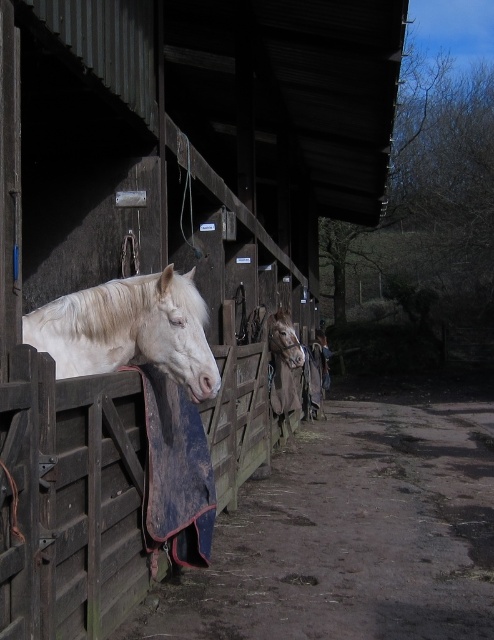
Question: Among these points, which one is farthest from the camera?

Choices:
 (A) (42, 472)
 (B) (182, 285)

Answer: (B)

Question: Does wooden stable door at center have a greater width compared to white matte horse at center?

Choices:
 (A) yes
 (B) no

Answer: (B)

Question: Is wooden stable door at center closer to the viewer compared to white matte horse at center?

Choices:
 (A) no
 (B) yes

Answer: (A)

Question: Which object is closer to the camera taking this photo?

Choices:
 (A) wooden stable door at center
 (B) white matte horse at center

Answer: (B)

Question: Which point is farther from the camera taking this photo?

Choices:
 (A) (44, 560)
 (B) (45, 310)

Answer: (B)

Question: Can you confirm if wooden stable door at center is smaller than white matte horse at center?

Choices:
 (A) no
 (B) yes

Answer: (A)